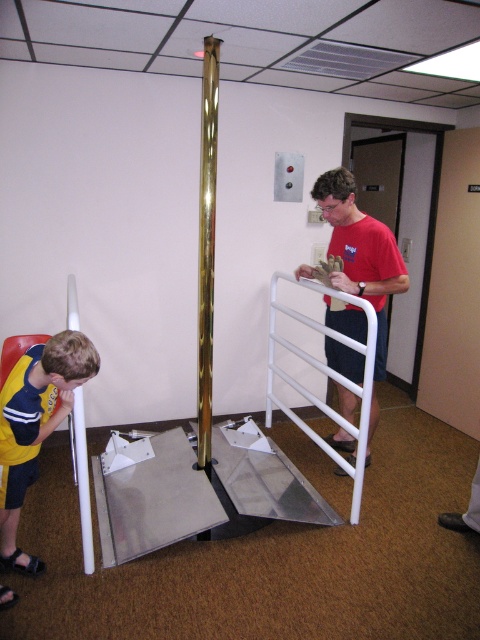
I want to click on red t-shirt at center, so click(x=360, y=252).

I want to click on red t-shirt at center, so click(x=360, y=252).

Who is shorter, yellow fabric shirt at lower left or white matte rail at center?

With less height is yellow fabric shirt at lower left.

You are a GUI agent. You are given a task and a screenshot of the screen. Output one action in this format:
    pyautogui.click(x=<x>, y=<y>)
    Task: Click on the yellow fabric shirt at lower left
    This screenshot has height=640, width=480.
    Given the screenshot: What is the action you would take?
    pyautogui.click(x=37, y=410)

At what (x,y) coordinates should I click in order to perform the action: click on yellow fabric shirt at lower left. Please return your answer as a coordinate pair (x, y). This screenshot has height=640, width=480. Looking at the image, I should click on (37, 410).

I want to click on yellow fabric shirt at lower left, so click(x=37, y=410).

Which is above, red t-shirt at center or yellow fabric shirt at lower left?

red t-shirt at center is higher up.

Measure the distance between red t-shirt at center and camera.

The distance of red t-shirt at center from camera is 2.73 meters.

At what (x,y) coordinates should I click in order to perform the action: click on red t-shirt at center. Please return your answer as a coordinate pair (x, y). The width and height of the screenshot is (480, 640). Looking at the image, I should click on pos(360,252).